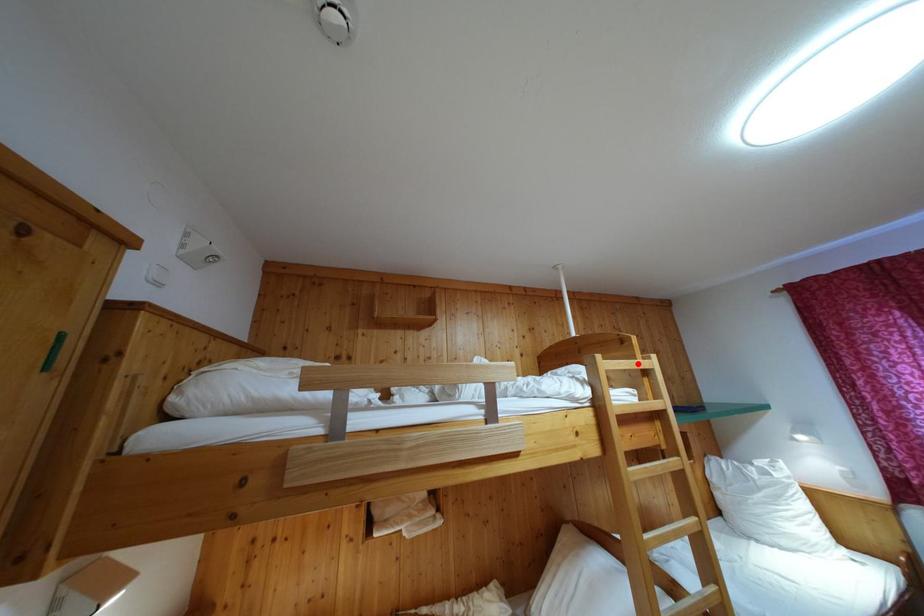
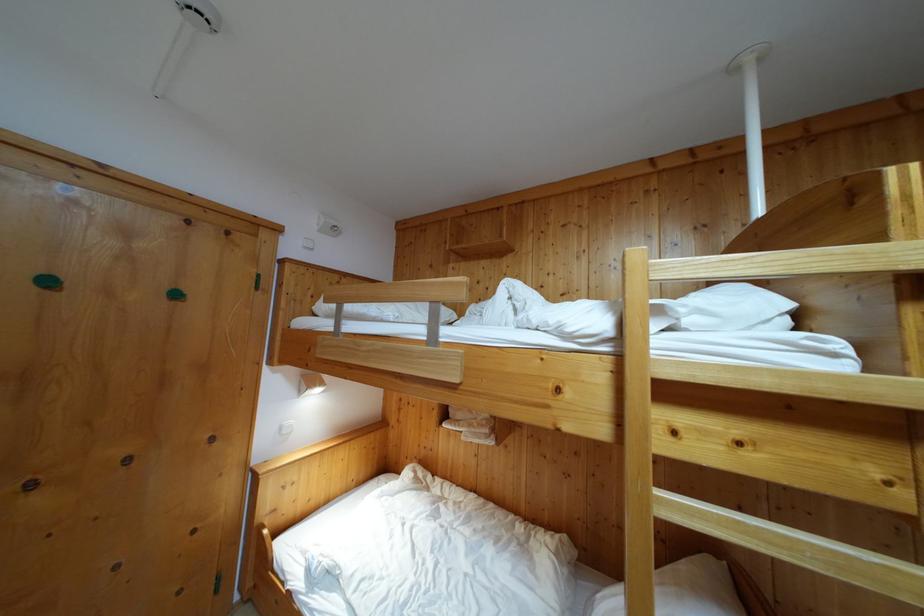
The point at the highlighted location is marked in the first image. Where is the corresponding point in the second image?

(881, 245)